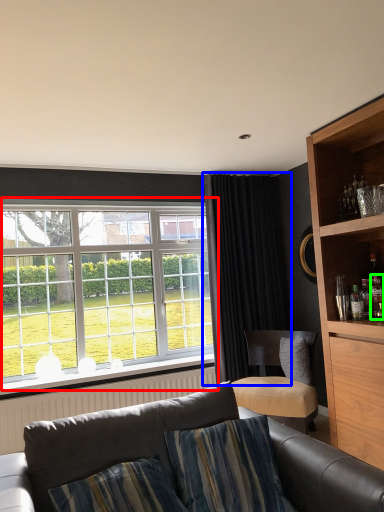
Question: Which object is the closest to the window (highlighted by a red box)? Choose among these: curtain (highlighted by a blue box) or bottle (highlighted by a green box).

Choices:
 (A) curtain
 (B) bottle

Answer: (A)